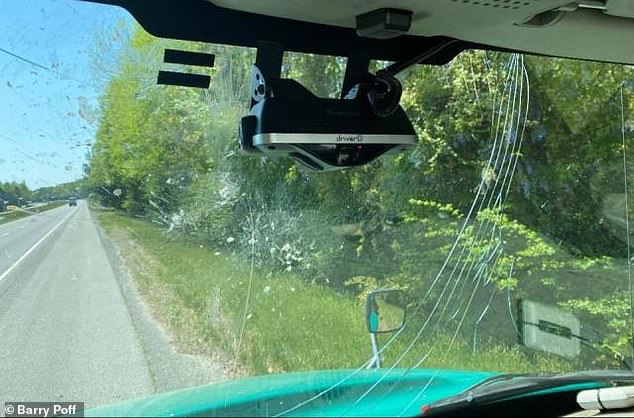
The height and width of the screenshot is (418, 634). Identify the location of cracked glass. (477, 286), (482, 199), (510, 281).